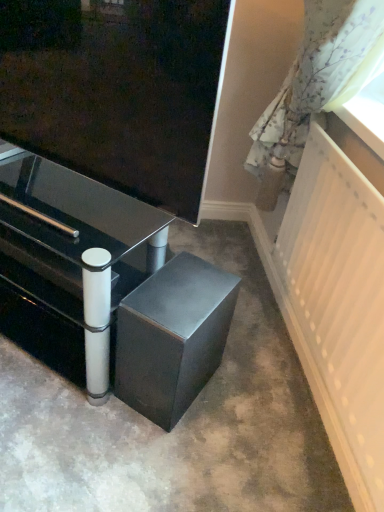
The image size is (384, 512). Find the location of `vacant area on top of white glossy drawer at lower left (from a real-world perspective)`. vacant area on top of white glossy drawer at lower left (from a real-world perspective) is located at coordinates (41, 254).